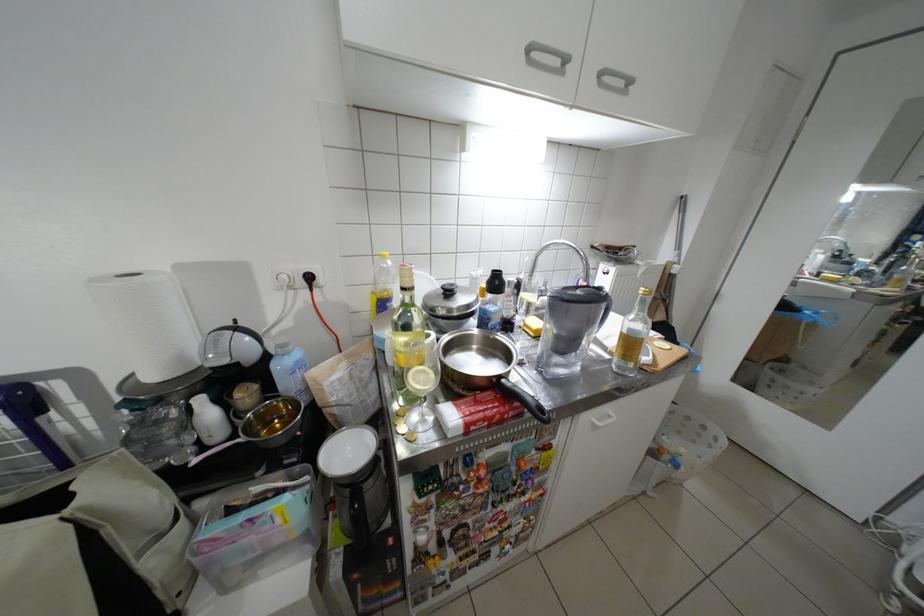
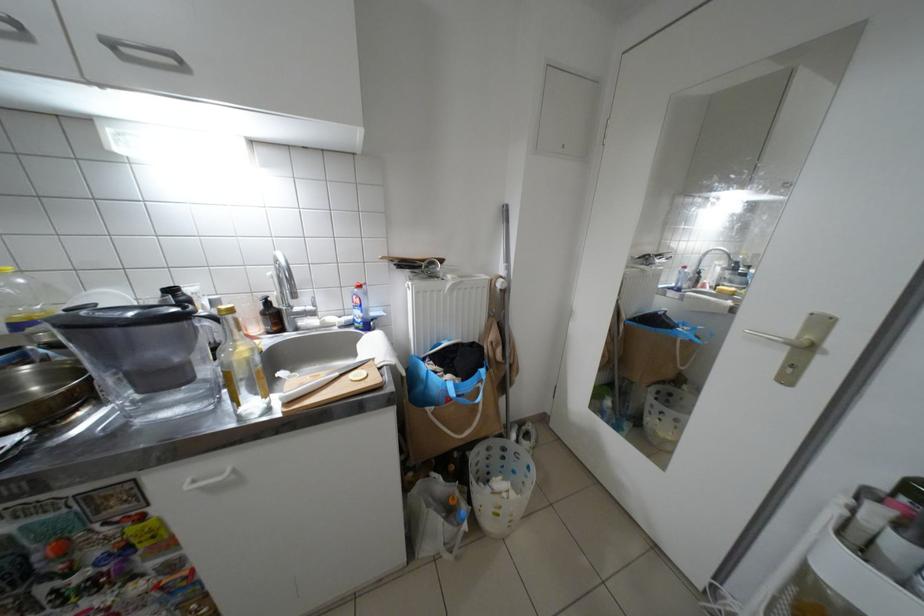
The point at (575, 334) is marked in the first image. Where is the corresponding point in the second image?

(139, 369)